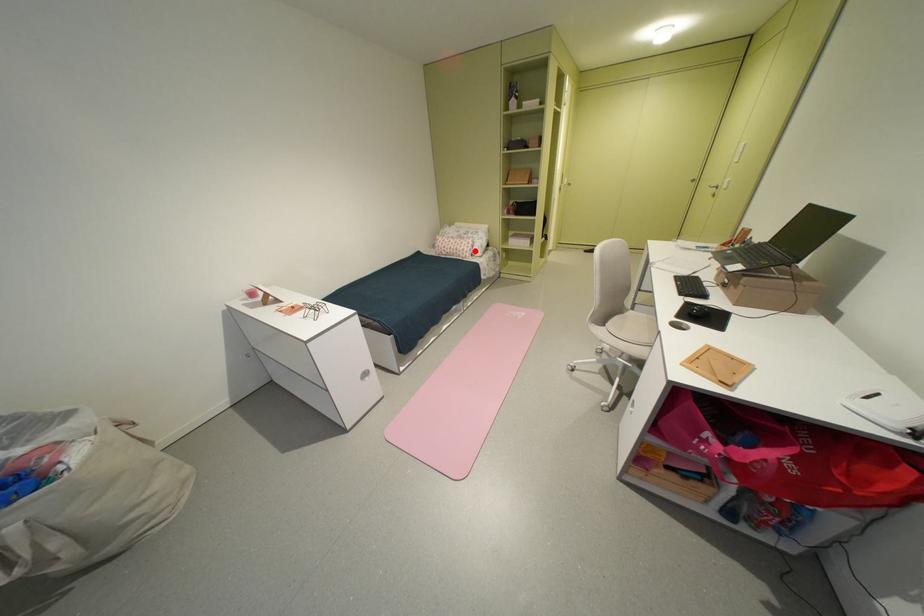
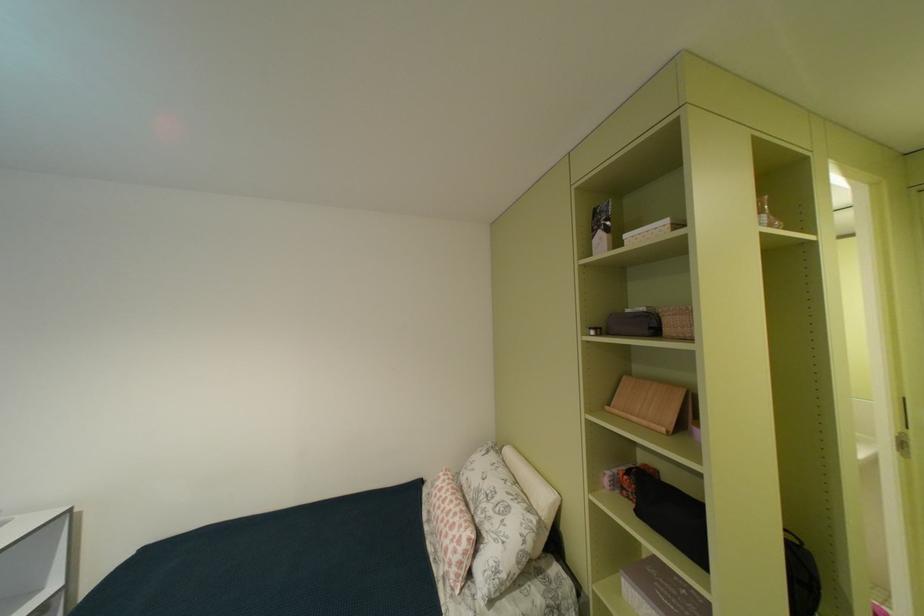
Find the pixel in the second image that matches the highlighted location in the first image.

(458, 556)